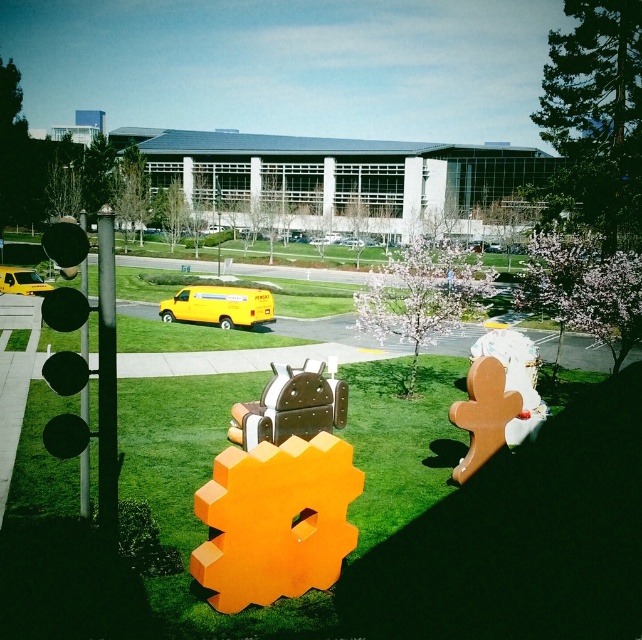
Which is behind, point (180, 308) or point (33, 292)?

The point (33, 292) is more distant.

Does point (239, 316) lie behind point (22, 269)?

No, (239, 316) is closer to viewer.

Between point (254, 304) and point (15, 285), which one is positioned in front?

Positioned in front is point (254, 304).

The width and height of the screenshot is (642, 640). Identify the location of yellow matte van at center. (218, 305).